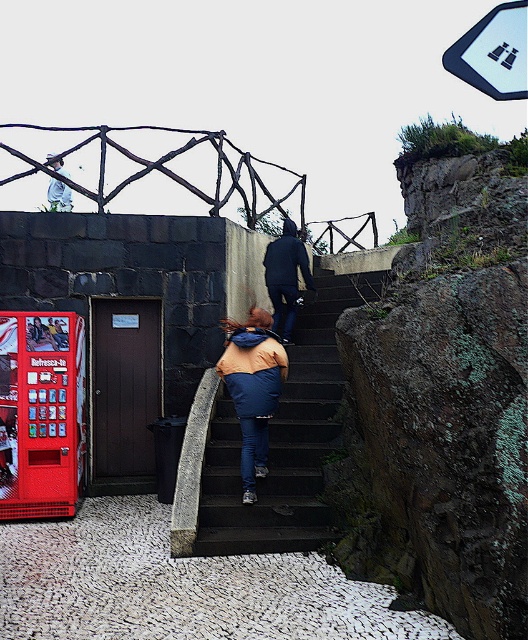
Question: Is dark blue jacket at upper center above matte black jacket at upper center?

Choices:
 (A) no
 (B) yes

Answer: (A)

Question: Which object is the closest to the dark blue jacket at upper center?

Choices:
 (A) matte black jacket at upper center
 (B) dark gray concrete stairs at center
 (C) blue plastic binoculars at upper center

Answer: (B)

Question: Is dark blue jacket at upper center below matte black jacket at upper center?

Choices:
 (A) yes
 (B) no

Answer: (A)

Question: Which is nearer to the matte black jacket at upper center?

Choices:
 (A) orange fabric jacket at center
 (B) red plastic vending machine at lower left
 (C) dark blue jacket at upper center
 (D) dark gray concrete stairs at center

Answer: (C)

Question: Which point appears farthest from the camera in this image?

Choices:
 (A) (27, 374)
 (B) (281, 230)
 (C) (476, 84)

Answer: (B)

Question: Can you confirm if red plastic vending machine at lower left is thinner than orange fabric jacket at center?

Choices:
 (A) yes
 (B) no

Answer: (B)